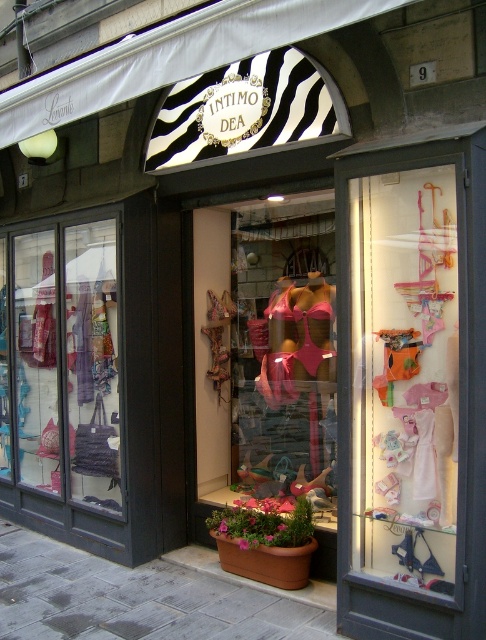
Question: Can you confirm if matte black bag at left is positioned to the right of gray concrete pavement at lower center?

Choices:
 (A) yes
 (B) no

Answer: (B)

Question: Is matte black bag at left to the left of gray concrete pavement at lower center from the viewer's perspective?

Choices:
 (A) no
 (B) yes

Answer: (B)

Question: Is the position of matte black bag at left less distant than that of gray concrete pavement at lower center?

Choices:
 (A) yes
 (B) no

Answer: (B)